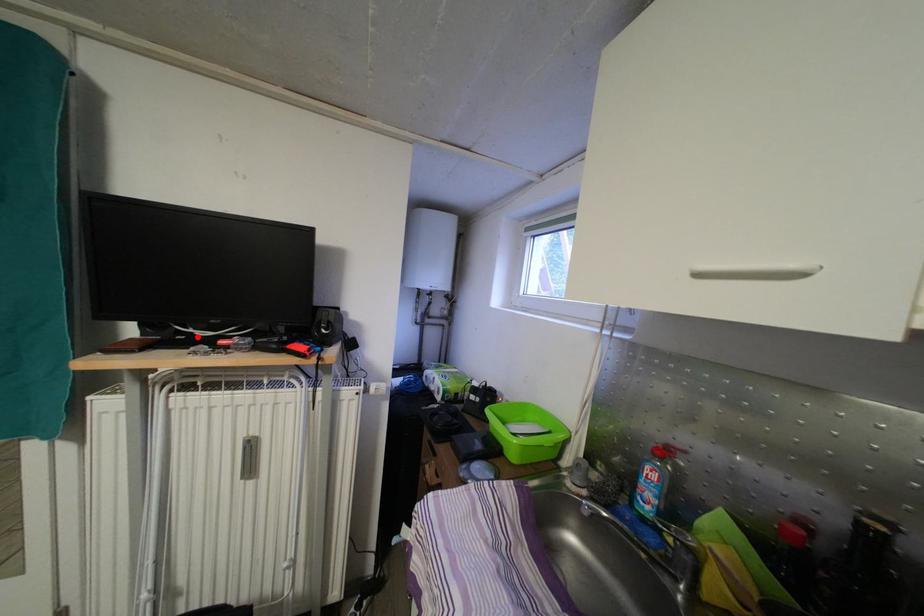
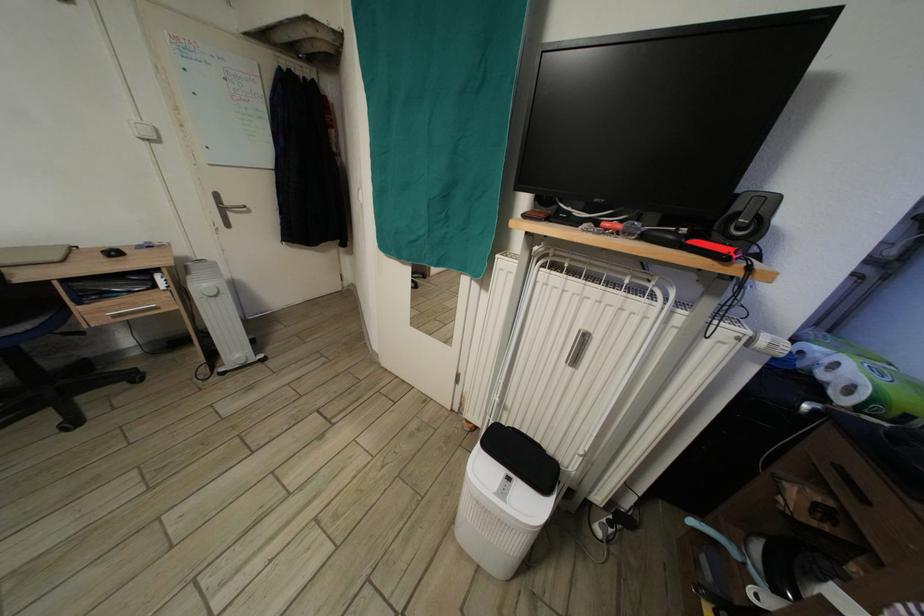
Where in the second image is the point corresponding to the highlighted location from the first image?

(576, 216)